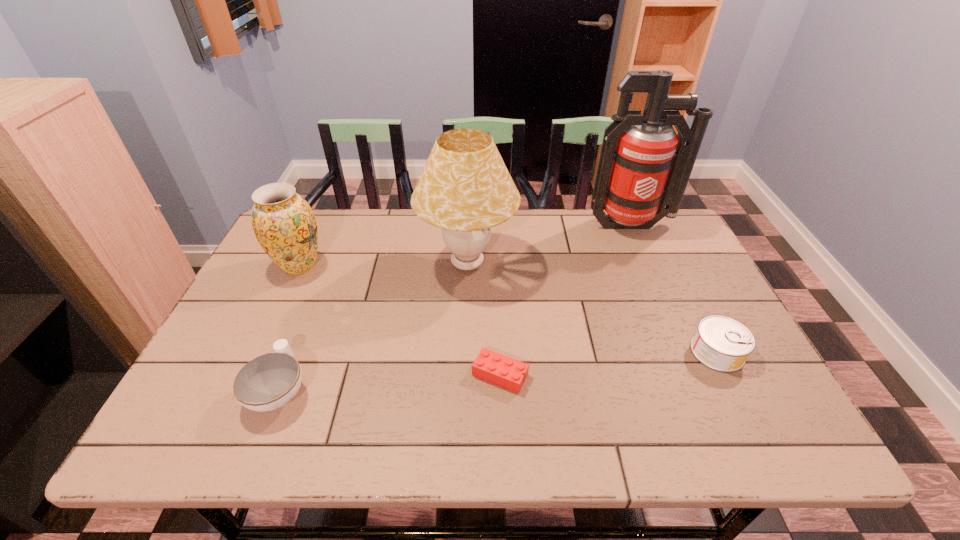
Locate an element on the screen. vacant region located 0.230m on the side with the handle of the chinaware is located at coordinates (319, 291).

Locate an element on the screen. Image resolution: width=960 pixels, height=540 pixels. vacant position located on the side with the handle of the chinaware is located at coordinates (319, 291).

At what (x,y) coordinates should I click in order to perform the action: click on free space located on the left of the can. Please return your answer as a coordinate pair (x, y). Looking at the image, I should click on (526, 352).

Locate an element on the screen. The height and width of the screenshot is (540, 960). free point located 0.080m on the back of the shortest object is located at coordinates (498, 331).

At what (x,y) coordinates should I click in order to perform the action: click on fire extinguisher that is at the far edge. Please return your answer as a coordinate pair (x, y). Looking at the image, I should click on tap(644, 165).

Locate an element on the screen. lampshade that is at the far edge is located at coordinates (465, 188).

Image resolution: width=960 pixels, height=540 pixels. Find the location of `vase that is positioned at the far edge`. vase that is positioned at the far edge is located at coordinates (284, 224).

You are a GUI agent. You are given a task and a screenshot of the screen. Output one action in this format:
    pyautogui.click(x=<x>, y=<y>)
    Task: Click on the object that is positioned at the near edge
    This screenshot has height=540, width=960.
    Given the screenshot: What is the action you would take?
    pyautogui.click(x=269, y=381)

Image resolution: width=960 pixels, height=540 pixels. What are the coordinates of `vase situated at the left edge` in the screenshot? It's located at (284, 224).

This screenshot has width=960, height=540. In order to click on chinaware that is at the left edge in this screenshot , I will do `click(269, 381)`.